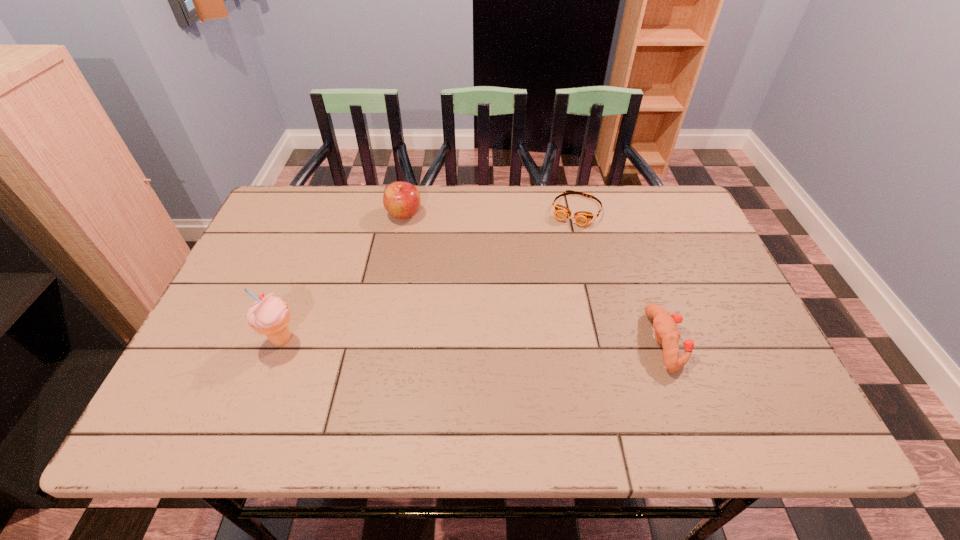
Locate an element on the screen. Image resolution: width=960 pixels, height=540 pixels. free region located with the lenses facing forward on the third object from left to right is located at coordinates (560, 251).

I want to click on free region located with the lenses facing forward on the third object from left to right, so click(554, 262).

Where is `free space located 0.190m with the lenses facing forward on the third object from left to right`? This screenshot has height=540, width=960. free space located 0.190m with the lenses facing forward on the third object from left to right is located at coordinates (550, 269).

Find the location of a particular element. The height and width of the screenshot is (540, 960). vacant space located 0.190m on the stem of the third shortest object is located at coordinates (439, 264).

Identify the location of free spot located on the stem of the third shortest object. (418, 234).

Where is `vacant space situated 0.260m on the stem of the third shortest object`? This screenshot has width=960, height=540. vacant space situated 0.260m on the stem of the third shortest object is located at coordinates (450, 280).

I want to click on goggles situated at the far edge, so click(582, 218).

Identify the location of apple present at the far edge. Image resolution: width=960 pixels, height=540 pixels. (402, 200).

I want to click on object positioned at the near edge, so click(x=664, y=323).

The height and width of the screenshot is (540, 960). I want to click on object that is positioned at the left edge, so click(269, 315).